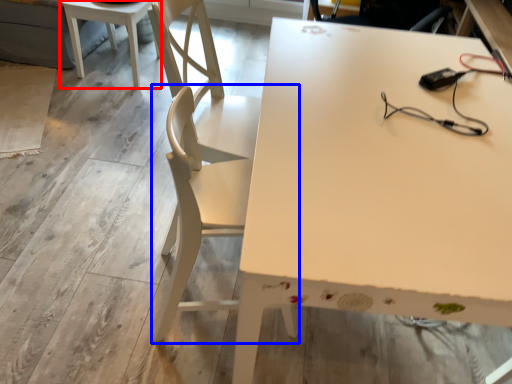
Question: Which point is further to the camera, table (highlighted by a red box) or chair (highlighted by a blue box)?

Choices:
 (A) table
 (B) chair

Answer: (A)